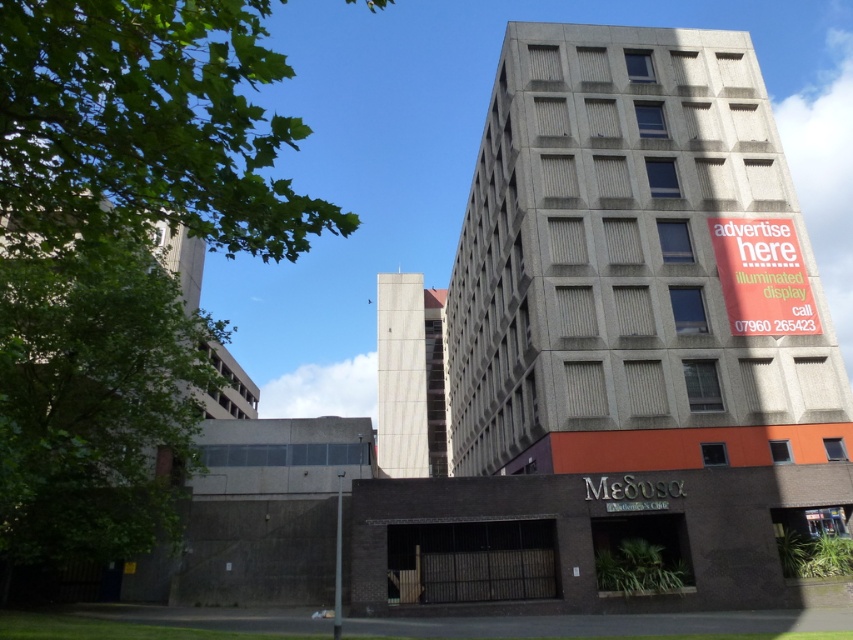
You are a city planner looking to install a new billboard. You need to choose between placing it on the white concrete building at center or the green concrete building at left. Based on their heights, which building would allow the billboard to be seen from farther away?

The white concrete building at center is much taller than the green concrete building at left, so placing the billboard on the white concrete building at center would allow it to be seen from farther away.

Based on the photo, you are a delivery person trying to navigate through the city streets. You see the concrete building at upper right and the green concrete building at left. Which building is closer to you based on their positions in the image?

The green concrete building at left is behind the concrete building at upper right, so the concrete building at upper right is closer to you.

You are a city planner reviewing this urban layout. You need to determine the spatial relationship between the concrete building at upper right and the green concrete building at left. Which building is located to the right of the other?

The concrete building at upper right is positioned on the right side of green concrete building at left.